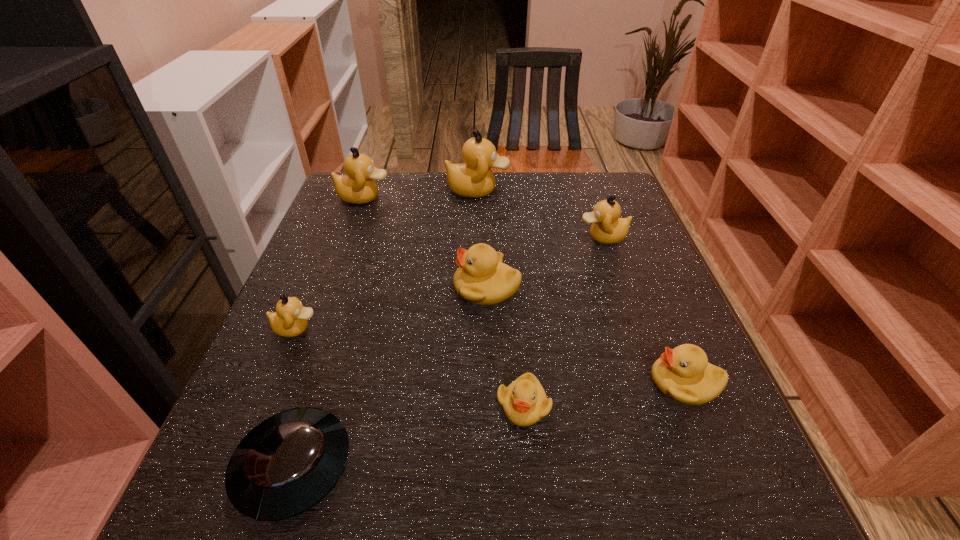
Where is `vacant point located between the smallest yellow duckling and the second smallest tan duckling`? Image resolution: width=960 pixels, height=540 pixels. vacant point located between the smallest yellow duckling and the second smallest tan duckling is located at coordinates (564, 321).

At what (x,y) coordinates should I click in order to perform the action: click on free space between the fifth nearest duckling and the shortest duckling. Please return your answer as a coordinate pair (x, y). This screenshot has height=540, width=960. Looking at the image, I should click on (564, 321).

I want to click on vacant region between the smallest yellow duckling and the second tallest object, so click(x=444, y=301).

You are a GUI agent. You are given a task and a screenshot of the screen. Output one action in this format:
    pyautogui.click(x=<x>, y=<y>)
    Task: Click on the free space between the fifth farthest object and the gray saucer
    
    Given the screenshot: What is the action you would take?
    pyautogui.click(x=295, y=397)

Locate an element on the screen. The height and width of the screenshot is (540, 960). free spot between the second biggest yellow duckling and the gray saucer is located at coordinates (489, 424).

Where is `empty space that is in between the gray saucer and the fifth nearest duckling`? The height and width of the screenshot is (540, 960). empty space that is in between the gray saucer and the fifth nearest duckling is located at coordinates (448, 352).

At what (x,y) coordinates should I click in order to perform the action: click on vacant area between the second smallest yellow duckling and the seventh shortest object. Please return your answer as a coordinate pair (x, y). This screenshot has width=960, height=540. Looking at the image, I should click on (524, 290).

Locate which object ranks sixth in proximity to the saucer. Please provide its 2D coordinates. Your answer should be formatted as a tuple, i.e. [(x, y)], where the tuple contains the x and y coordinates of a point satisfying the conditions above.

[(607, 228)]

Image resolution: width=960 pixels, height=540 pixels. Find the location of `object that stands as the closest to the smallest tan duckling`. object that stands as the closest to the smallest tan duckling is located at coordinates (288, 463).

Locate which duckling is the third closest to the tallest object. Please provide its 2D coordinates. Your answer should be formatted as a tuple, i.e. [(x, y)], where the tuple contains the x and y coordinates of a point satisfying the conditions above.

[(482, 279)]